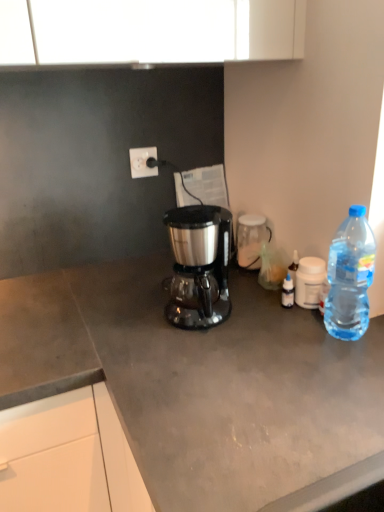
The width and height of the screenshot is (384, 512). I want to click on vacant space that's between satin black coffee maker at center and transparent plastic coffee cup at right, the first coffee cup positioned from the front, so click(x=255, y=310).